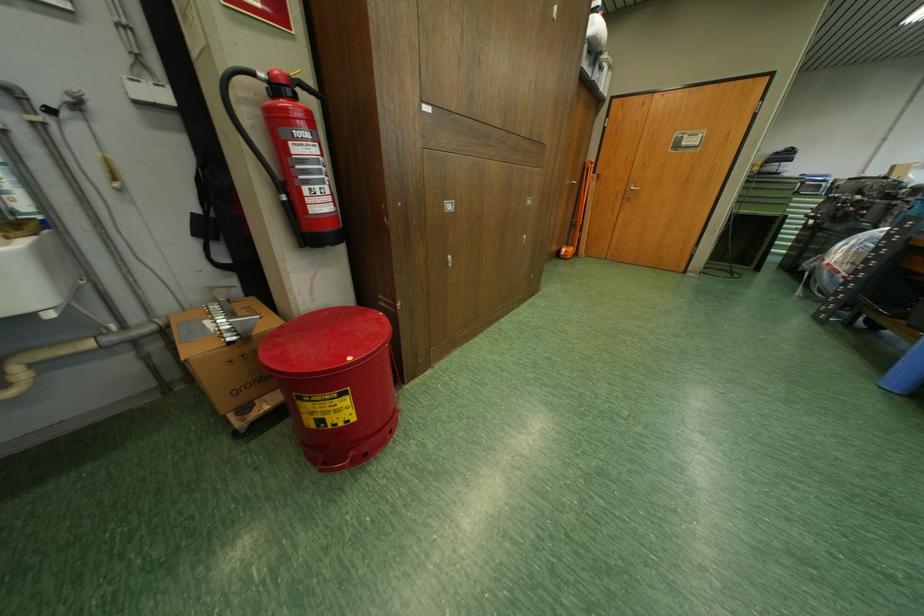
Identify the location of silver cabinet handle. (631, 190).